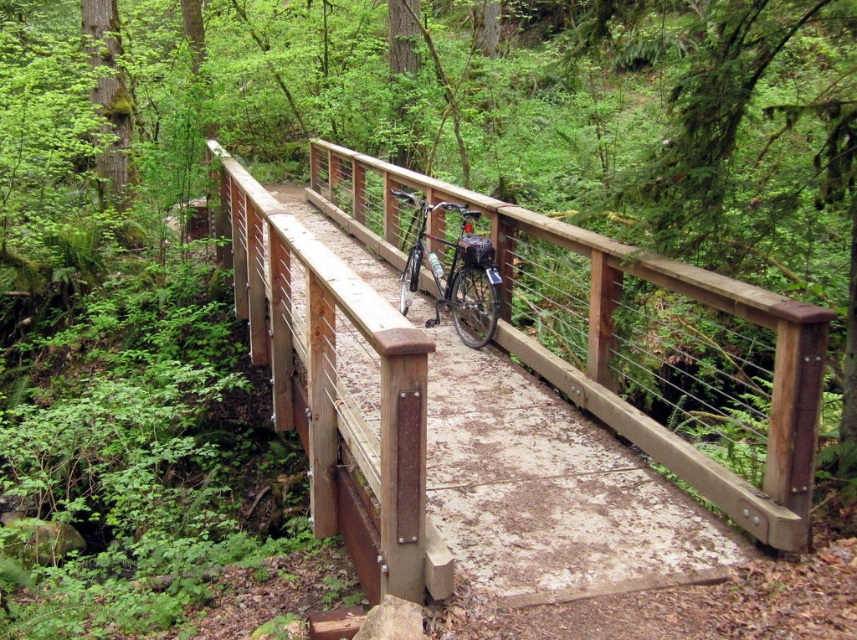
Which of these two, brown wooden bridge at center or silver metallic bicycle at center, stands taller?

With more height is silver metallic bicycle at center.

Which is more to the right, brown wooden bridge at center or silver metallic bicycle at center?

silver metallic bicycle at center

Locate an element on the screen. brown wooden bridge at center is located at coordinates (430, 428).

Locate an element on the screen. The height and width of the screenshot is (640, 857). brown wooden bridge at center is located at coordinates (430, 428).